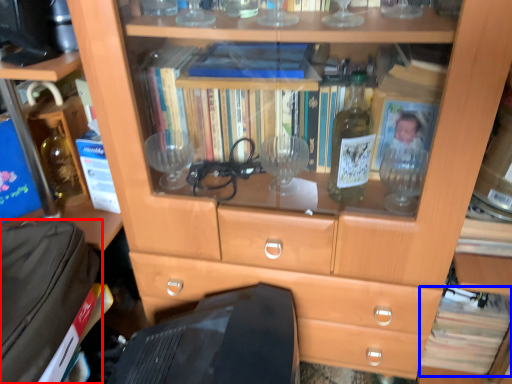
Question: Which object appears closest to the camera in this image, luggage (highlighted by a red box) or book (highlighted by a blue box)?

Choices:
 (A) luggage
 (B) book

Answer: (A)